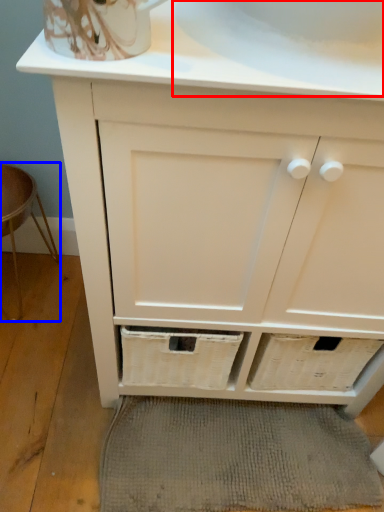
Question: Which point is further to the camera, sink (highlighted by a red box) or bar stool (highlighted by a blue box)?

Choices:
 (A) sink
 (B) bar stool

Answer: (B)